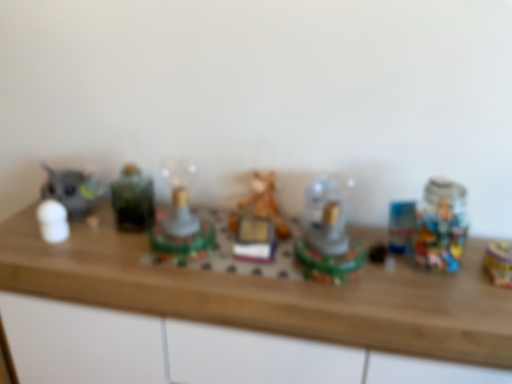
Identify the location of vacant space in front of green glass jar at left, the fifth toy from the right. Image resolution: width=512 pixels, height=384 pixels. (106, 258).